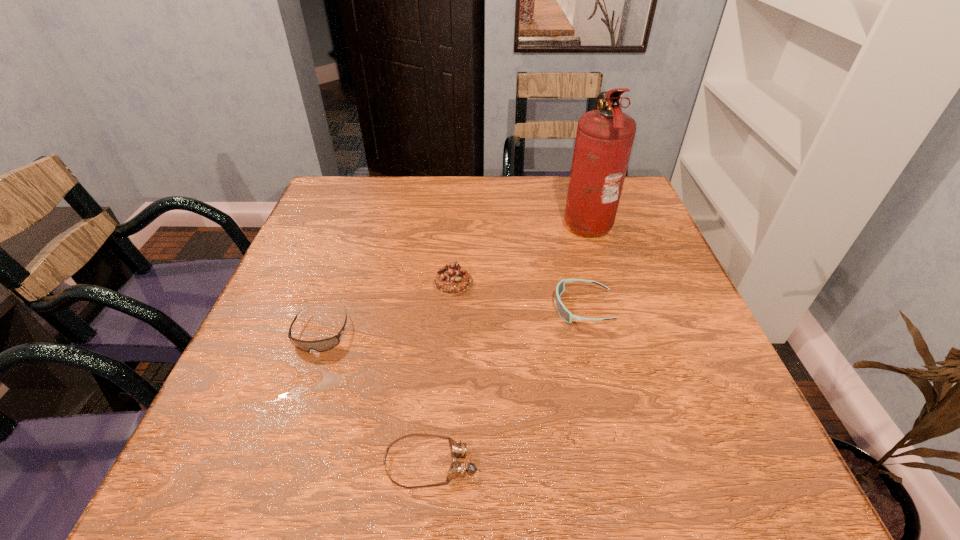
This screenshot has width=960, height=540. Find the location of `free space between the shortest object and the fire extinguisher`. free space between the shortest object and the fire extinguisher is located at coordinates (509, 342).

At what (x,y) coordinates should I click in order to perform the action: click on free spot between the chocolate cake and the farthest object. Please return your answer as a coordinate pair (x, y). This screenshot has width=960, height=540. Looking at the image, I should click on (519, 252).

The image size is (960, 540). I want to click on vacant space that is in between the nearest object and the rightmost goggles, so click(507, 386).

Find the location of a particular element. free space between the rightmost goggles and the nearest object is located at coordinates (507, 386).

Identify the location of free area in between the nearest object and the farthest object. The image size is (960, 540). (509, 342).

At what (x,y) coordinates should I click in order to perform the action: click on free space that is in between the fire extinguisher and the chocolate cake. Please return your answer as a coordinate pair (x, y). The image size is (960, 540). Looking at the image, I should click on (519, 252).

Identify which object is located as the nearest to the chocolate cake. Please provide its 2D coordinates. Your answer should be formatted as a tuple, i.e. [(x, y)], where the tuple contains the x and y coordinates of a point satisfying the conditions above.

[(326, 344)]

Identify the location of object that is the second closest to the leftmost object. This screenshot has height=540, width=960. (458, 449).

Identify which goggles is the third nearest to the chocolate cake. Please provide its 2D coordinates. Your answer should be formatted as a tuple, i.e. [(x, y)], where the tuple contains the x and y coordinates of a point satisfying the conditions above.

[(458, 449)]

Choose which goggles is the second nearest neighbor to the nearest object. Please provide its 2D coordinates. Your answer should be formatted as a tuple, i.e. [(x, y)], where the tuple contains the x and y coordinates of a point satisfying the conditions above.

[(566, 315)]